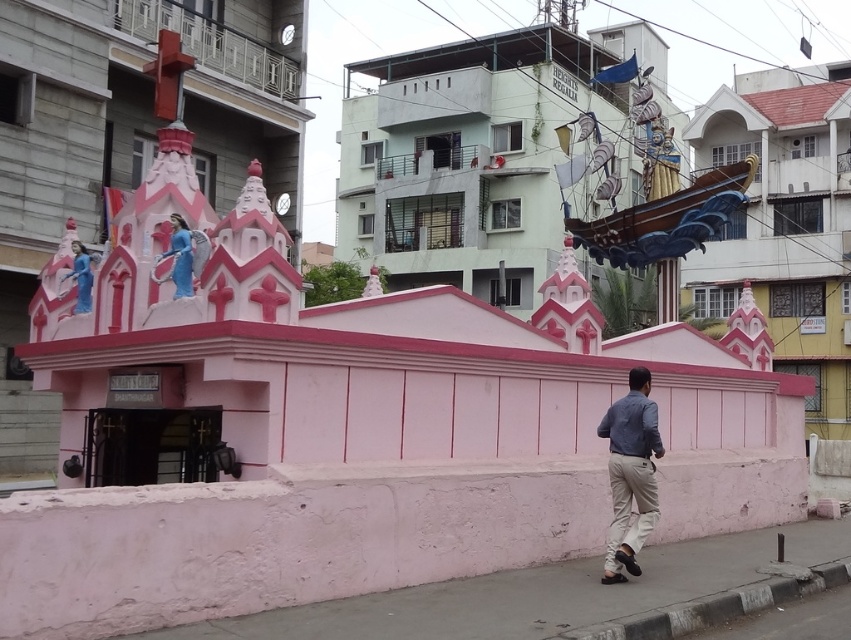
You are a delivery person trying to park your 1.2 meter wide cart. You see the gray concrete pavement at lower right and the blue glossy statue at upper left. Which location has enough space for your cart?

The gray concrete pavement at lower right might be wider than blue glossy statue at upper left, so it is possible that the gray concrete pavement at lower right has enough space for your cart.